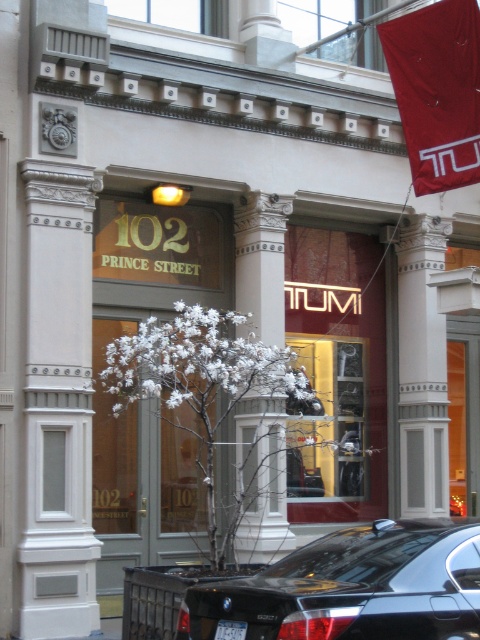
Question: Which object is the closest to the white marble column at center?

Choices:
 (A) white plastic license plate at lower center
 (B) red fabric flag at upper right
 (C) black glossy car at lower center

Answer: (B)

Question: Is red fabric flag at upper right to the left of white marble column at center from the viewer's perspective?

Choices:
 (A) no
 (B) yes

Answer: (B)

Question: Is black glossy car at lower center wider than red fabric flag at upper right?

Choices:
 (A) no
 (B) yes

Answer: (B)

Question: Which object is farther from the camera taking this photo?

Choices:
 (A) white plastic license plate at lower center
 (B) white marble column at center
 (C) red fabric flag at upper right
 (D) black glossy car at lower center

Answer: (B)

Question: Does red fabric flag at upper right appear on the left side of white marble column at center?

Choices:
 (A) no
 (B) yes

Answer: (B)

Question: Which object appears farthest from the camera in this image?

Choices:
 (A) white marble column at center
 (B) black glossy car at lower center
 (C) white plastic license plate at lower center
 (D) red fabric flag at upper right

Answer: (A)